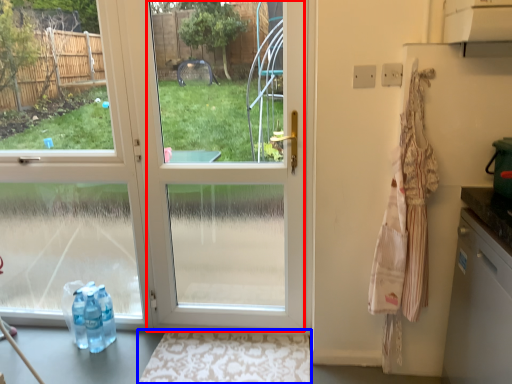
Question: Which object is further to the camera taking this photo, glass door (highlighted by a red box) or doormat (highlighted by a blue box)?

Choices:
 (A) glass door
 (B) doormat

Answer: (B)